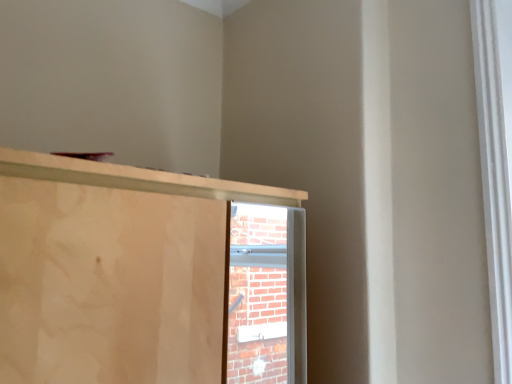
The height and width of the screenshot is (384, 512). What do you see at coordinates (109, 285) in the screenshot?
I see `plywood at upper center` at bounding box center [109, 285].

What is the approximate width of plywood at upper center?

28.58 inches.

Where is `plywood at upper center`? plywood at upper center is located at coordinates (109, 285).

Measure the distance between plywood at upper center and camera.

They are 27.08 inches apart.

You are a GUI agent. You are given a task and a screenshot of the screen. Output one action in this format:
    pyautogui.click(x=<x>, y=<y>)
    Task: Click on the plywood at upper center
    The height and width of the screenshot is (384, 512).
    Given the screenshot: What is the action you would take?
    click(x=109, y=285)